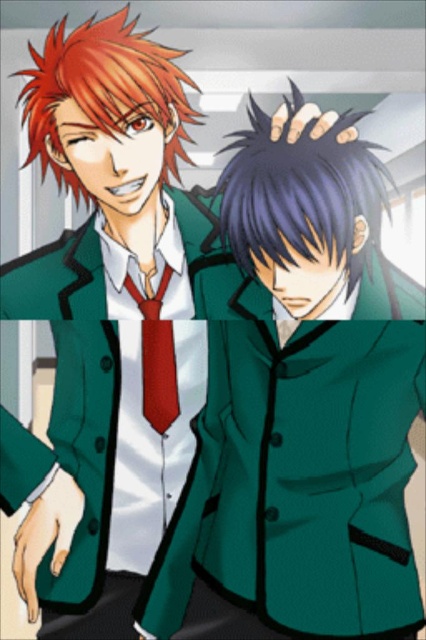
Does green woolen blazer at center come behind matte red tie at center?

That is False.

Does green woolen blazer at center have a greater width compared to matte red tie at center?

Correct, the width of green woolen blazer at center exceeds that of matte red tie at center.

Is point (313, 621) in front of point (161, 324)?

Yes, point (313, 621) is closer to viewer.

This screenshot has height=640, width=426. What are the coordinates of `green woolen blazer at center` in the screenshot? It's located at (301, 481).